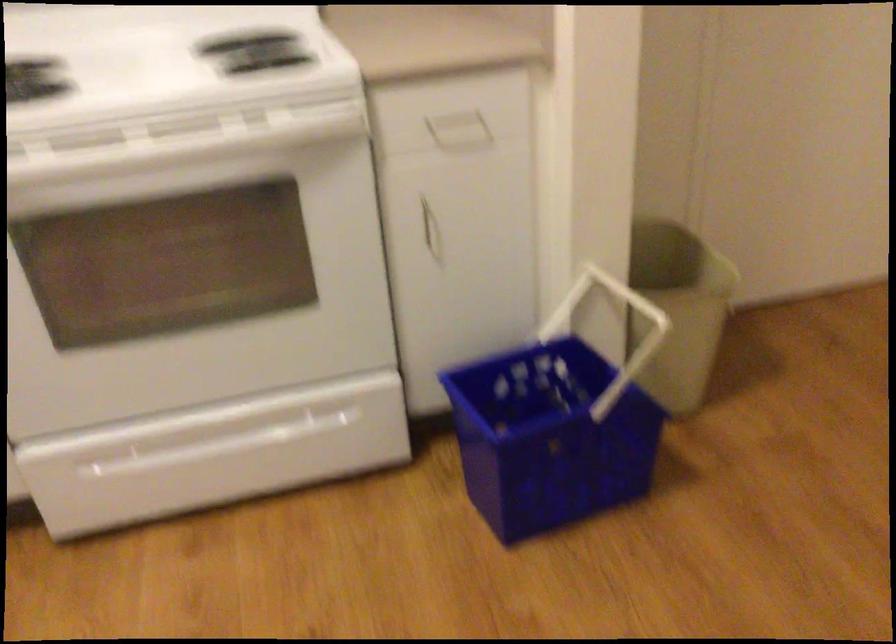
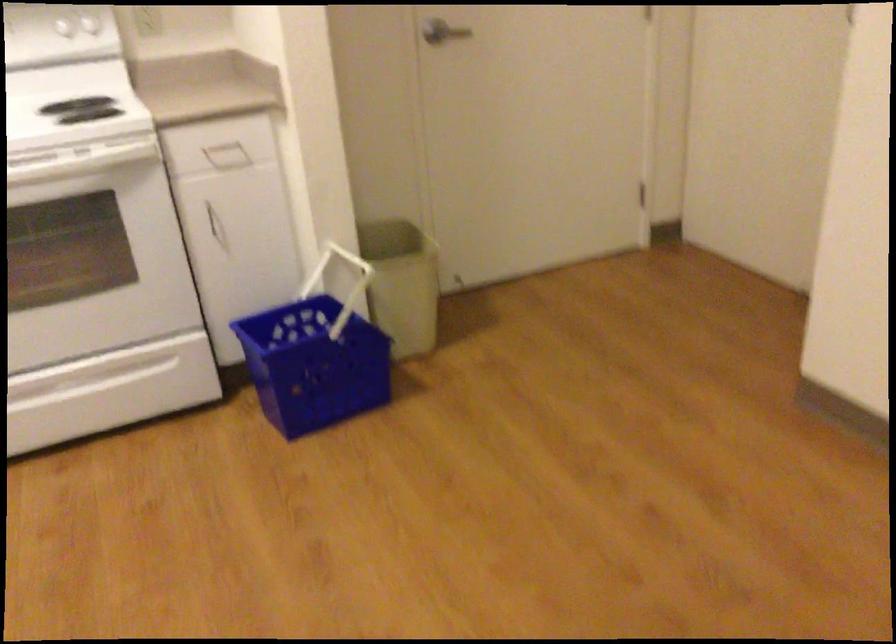
The point at (x=428, y=228) is marked in the first image. Where is the corresponding point in the second image?

(216, 225)